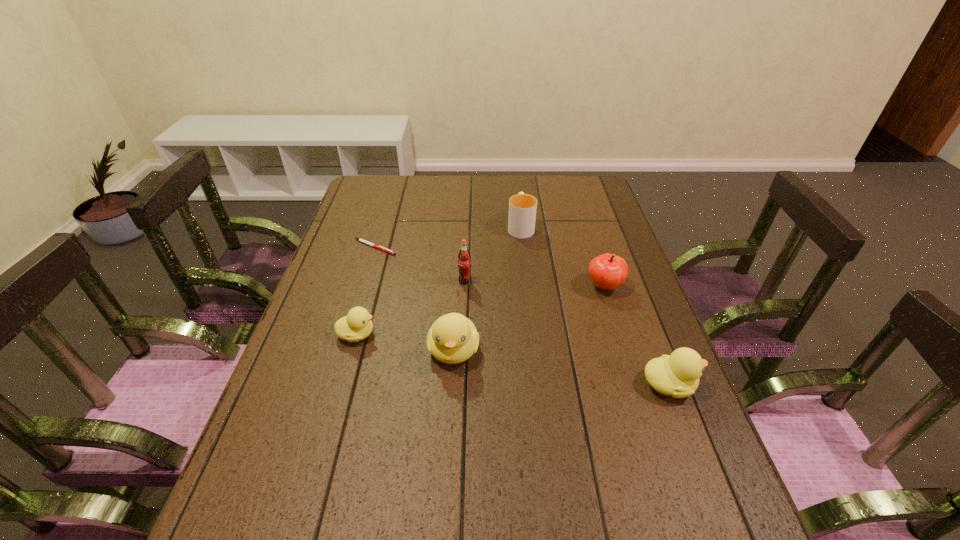
What are the coordinates of `vacant area situated at the beak of the leftmost duckling` in the screenshot? It's located at point(423,334).

At what (x,y) coordinates should I click in order to perform the action: click on blank area located 0.210m at the beak of the second duckling from right to left. Please return your answer as a coordinate pair (x, y). The height and width of the screenshot is (540, 960). Looking at the image, I should click on (447, 462).

The image size is (960, 540). What are the coordinates of `free region located with the handle on the side of the fifth object from left to right` in the screenshot? It's located at (516, 191).

You are a GUI agent. You are given a task and a screenshot of the screen. Output one action in this format:
    pyautogui.click(x=<x>, y=<y>)
    Task: Click on the free space located 0.060m with the handle on the side of the fifth object from left to right
    
    Given the screenshot: What is the action you would take?
    pyautogui.click(x=518, y=206)

Where is `free space located 0.050m with the handle on the side of the fifth object from left to right`? Image resolution: width=960 pixels, height=540 pixels. free space located 0.050m with the handle on the side of the fifth object from left to right is located at coordinates (518, 207).

Where is `vacant space located on the clicker of the pen`? The image size is (960, 540). vacant space located on the clicker of the pen is located at coordinates (439, 247).

Locate an element on the screen. free point located on the left of the apple is located at coordinates (448, 286).

Locate an element on the screen. vacant space located on the label of the soda bottle is located at coordinates (464, 308).

At what (x,y) coordinates should I click in order to perform the action: click on duckling that is at the left edge. Please return your answer as a coordinate pair (x, y). This screenshot has width=960, height=540. Looking at the image, I should click on (357, 325).

Where is `pen present at the left edge`? Image resolution: width=960 pixels, height=540 pixels. pen present at the left edge is located at coordinates (359, 239).